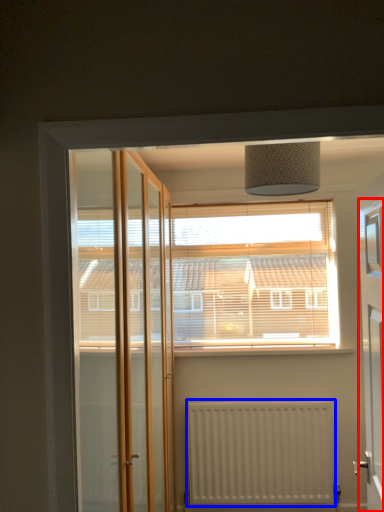
Question: Which object is closer to the camera taking this photo, elevator (highlighted by a red box) or radiator (highlighted by a blue box)?

Choices:
 (A) elevator
 (B) radiator

Answer: (A)